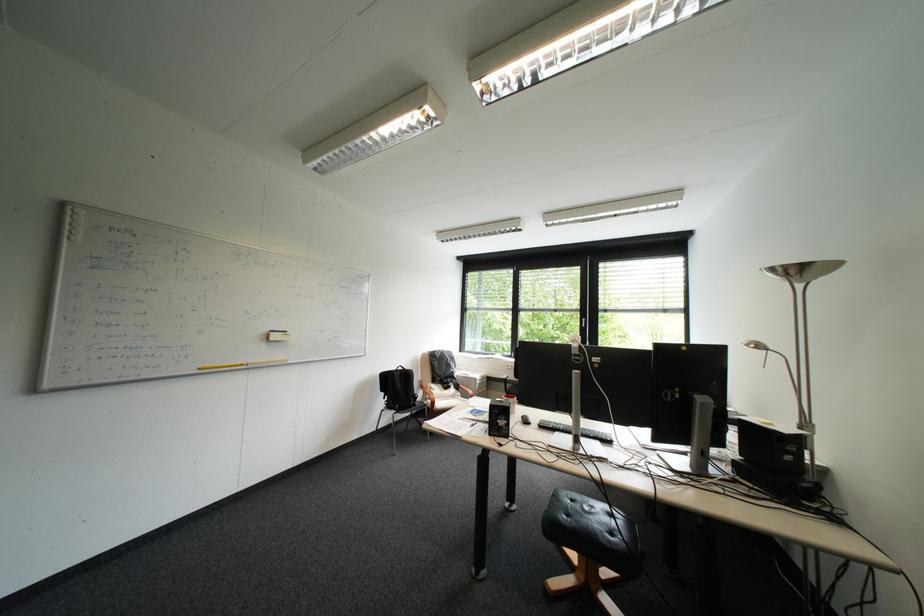
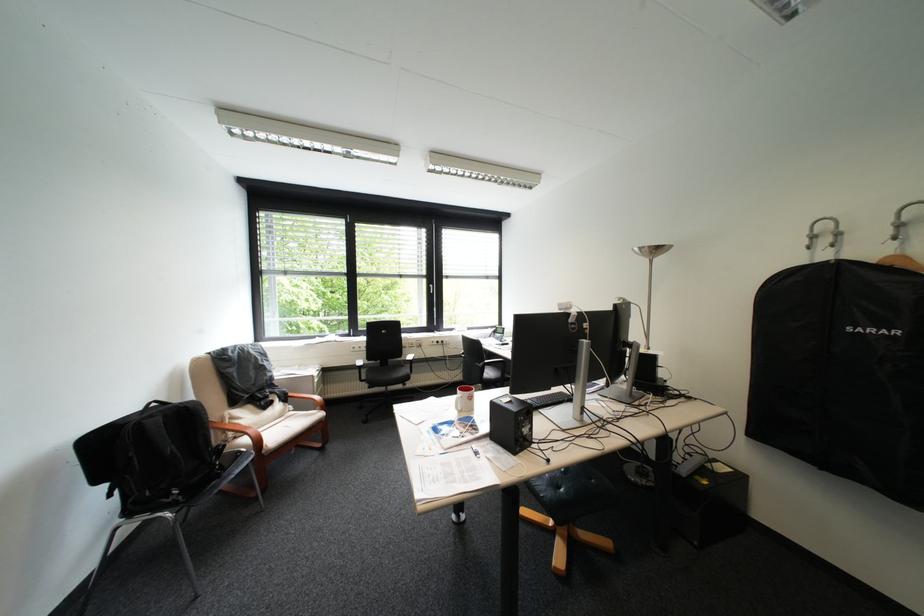
The point at (445, 403) is marked in the first image. Where is the corresponding point in the second image?

(271, 443)